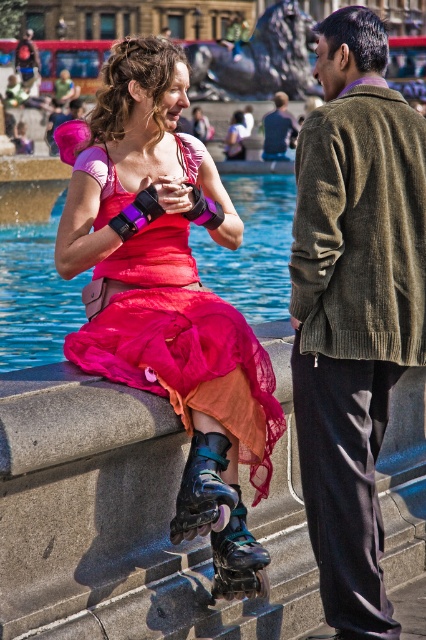
Question: Does shiny black roller skates at center appear under shiny blue roller skates at lower center?

Choices:
 (A) no
 (B) yes

Answer: (A)

Question: In this image, where is matte pink dress at center located relative to matte black jacket at center?

Choices:
 (A) right
 (B) left

Answer: (B)

Question: Which of the following is the closest to the observer?

Choices:
 (A) matte black jacket at center
 (B) blue glossy water at center
 (C) matte pink dress at center

Answer: (C)

Question: Which point is closer to the camera?

Choices:
 (A) shiny black roller skates at center
 (B) matte pink dress at center
 (C) green corduroy jacket at right
 (D) blue glossy water at center

Answer: (A)

Question: Which point is farther from the camera taking this photo?

Choices:
 (A) (287, 122)
 (B) (189, 460)
 (C) (199, 296)
 (D) (276, 298)

Answer: (A)

Question: Is matte pink dress at center positioned before shiny black roller skates at center?

Choices:
 (A) no
 (B) yes

Answer: (A)